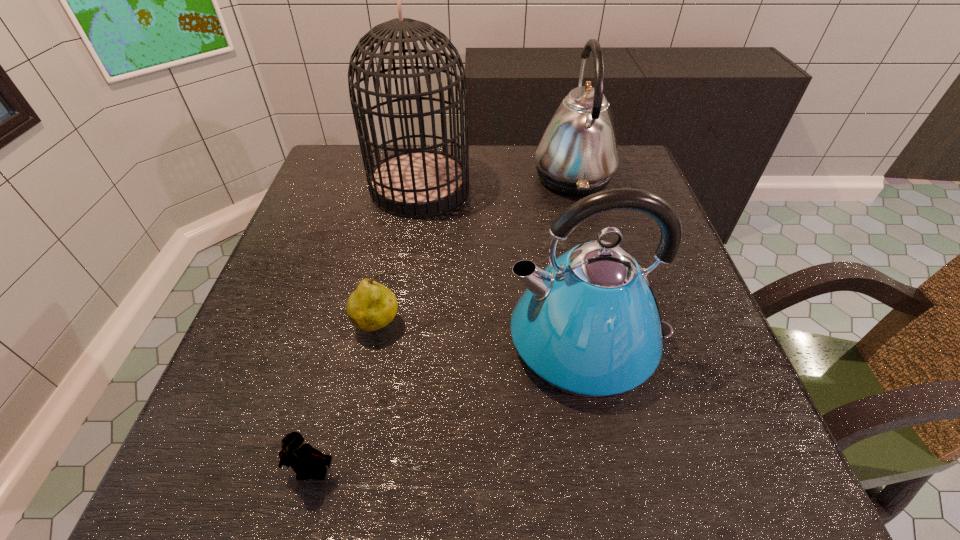
What are the coordinates of `the tallest object` in the screenshot? It's located at (413, 183).

Locate an element on the screen. the farther kettle is located at coordinates (577, 154).

I want to click on the nearer kettle, so click(588, 324).

The width and height of the screenshot is (960, 540). What are the coordinates of `pear` in the screenshot? It's located at (372, 306).

This screenshot has width=960, height=540. In order to click on the nearest object in this screenshot , I will do `click(304, 459)`.

Where is `the shortest object`? The width and height of the screenshot is (960, 540). the shortest object is located at coordinates (304, 459).

The width and height of the screenshot is (960, 540). Find the location of `free spot located 0.190m on the front of the birdcage`. free spot located 0.190m on the front of the birdcage is located at coordinates (405, 278).

At what (x,y) coordinates should I click in order to perform the action: click on vacant space situated 0.200m from the spout of the farther kettle. Please return your answer as a coordinate pair (x, y). This screenshot has height=540, width=960. Looking at the image, I should click on (454, 176).

Locate an element on the screen. vacant space situated from the spout of the farther kettle is located at coordinates (486, 176).

The image size is (960, 540). Find the location of `vacant region located 0.270m from the spout of the farther kettle`. vacant region located 0.270m from the spout of the farther kettle is located at coordinates (427, 176).